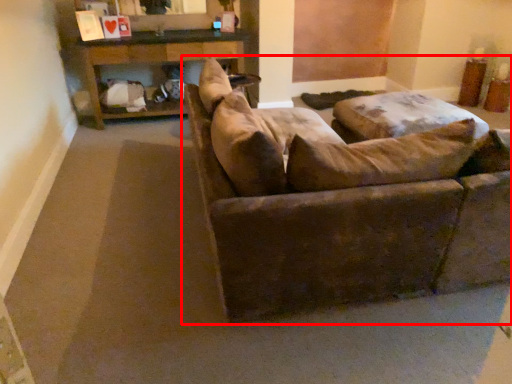
Question: From the image, what is the correct spatial relationship of studio couch (annotated by the red box) in relation to table?

Choices:
 (A) left
 (B) right

Answer: (B)